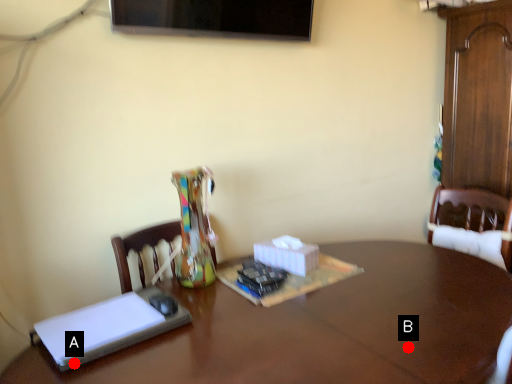
Question: Two points are circled on the image, labeled by A and B beside each circle. Which point is further to the camera?

Choices:
 (A) A is further
 (B) B is further

Answer: (B)